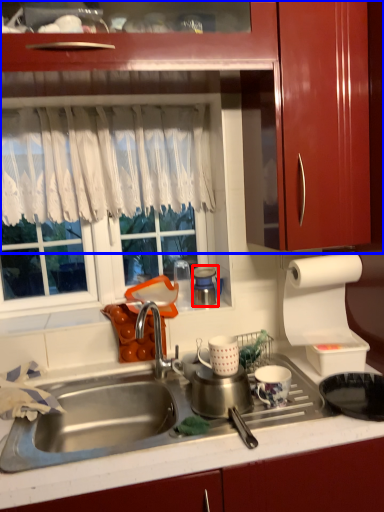
Question: Among these objects, which one is farthest to the camera, appliance (highlighted by a red box) or cabinetry (highlighted by a blue box)?

Choices:
 (A) appliance
 (B) cabinetry

Answer: (A)